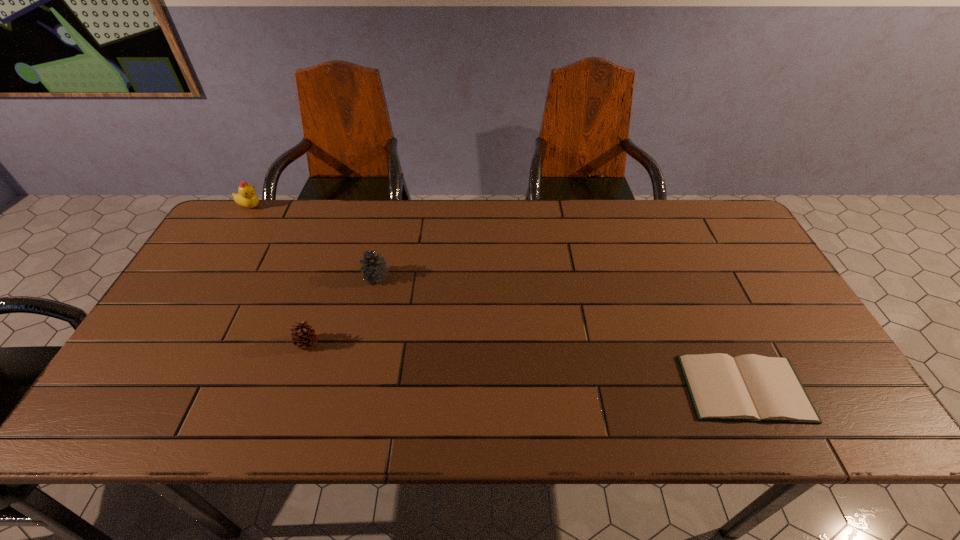
Find the location of `free space that satisfies the following two spatial constraints: 1. on the front-facing side of the leftmost object; 2. on the left side of the rightmost object`. free space that satisfies the following two spatial constraints: 1. on the front-facing side of the leftmost object; 2. on the left side of the rightmost object is located at coordinates (142, 388).

You are a GUI agent. You are given a task and a screenshot of the screen. Output one action in this format:
    pyautogui.click(x=<x>, y=<y>)
    Task: Click on the vacant space that satisfies the following two spatial constraints: 1. on the front-facing side of the nearer pinecone; 2. on the right side of the duckling
    The width and height of the screenshot is (960, 540).
    Given the screenshot: What is the action you would take?
    pyautogui.click(x=168, y=343)

Find the location of a particular element. Image resolution: width=960 pixels, height=540 pixels. vacant space that satisfies the following two spatial constraints: 1. on the back side of the right pinecone; 2. on the front-facing side of the farthest object is located at coordinates (393, 206).